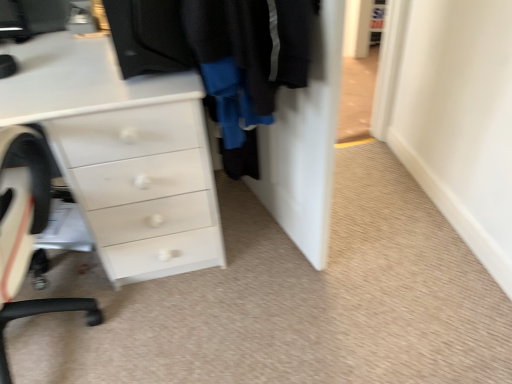
Question: Could you tell me if black fabric door at center is turned towards white glossy chest of drawers at center?

Choices:
 (A) no
 (B) yes

Answer: (B)

Question: Is black fabric door at center located outside white glossy chest of drawers at center?

Choices:
 (A) no
 (B) yes

Answer: (B)

Question: Considering the relative positions of black fabric door at center and white glossy chest of drawers at center in the image provided, is black fabric door at center to the right of white glossy chest of drawers at center from the viewer's perspective?

Choices:
 (A) yes
 (B) no

Answer: (A)

Question: Can you confirm if black fabric door at center is bigger than white glossy chest of drawers at center?

Choices:
 (A) yes
 (B) no

Answer: (B)

Question: Can you confirm if black fabric door at center is wider than white glossy chest of drawers at center?

Choices:
 (A) no
 (B) yes

Answer: (A)

Question: Is black fabric door at center not near white glossy chest of drawers at center?

Choices:
 (A) yes
 (B) no

Answer: (B)

Question: From a real-world perspective, is white glossy chest of drawers at center over black fabric door at center?

Choices:
 (A) no
 (B) yes

Answer: (A)

Question: Considering the relative positions of white glossy chest of drawers at center and black fabric door at center in the image provided, is white glossy chest of drawers at center to the left of black fabric door at center from the viewer's perspective?

Choices:
 (A) no
 (B) yes

Answer: (B)

Question: Is white glossy chest of drawers at center touching black fabric door at center?

Choices:
 (A) no
 (B) yes

Answer: (A)

Question: Is white glossy chest of drawers at center located outside black fabric door at center?

Choices:
 (A) yes
 (B) no

Answer: (A)

Question: Does white glossy chest of drawers at center have a smaller size compared to black fabric door at center?

Choices:
 (A) yes
 (B) no

Answer: (B)

Question: Is white glossy chest of drawers at center not near black fabric door at center?

Choices:
 (A) no
 (B) yes

Answer: (A)

Question: Can you see white glossy chest of drawers at center touching white plastic chair at left?

Choices:
 (A) yes
 (B) no

Answer: (B)